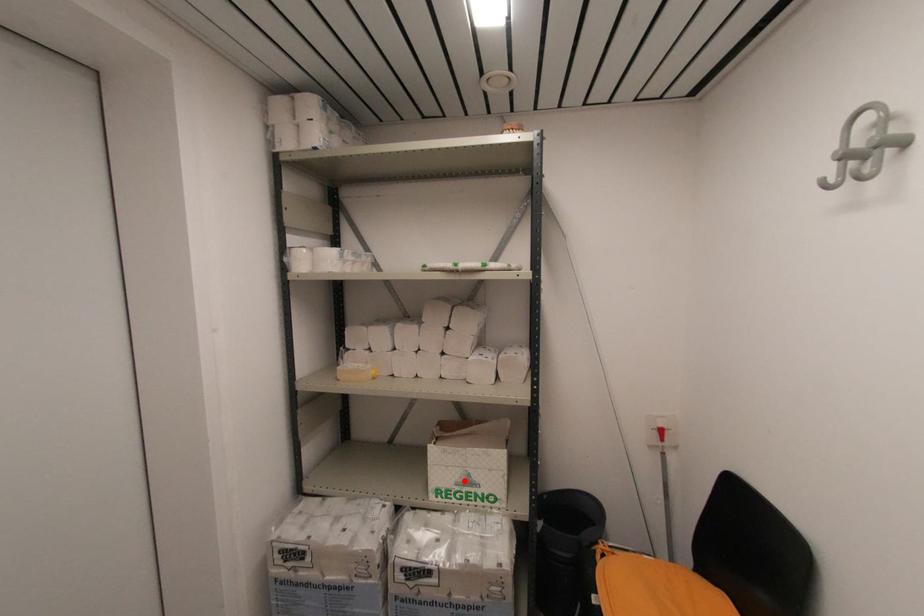
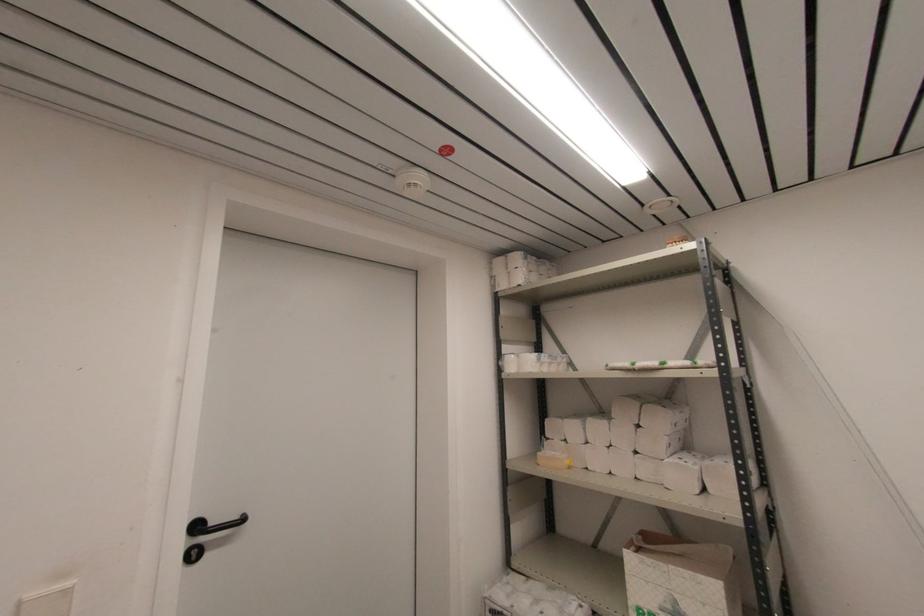
The point at the highlighted location is marked in the first image. Where is the corresponding point in the second image?

(671, 609)